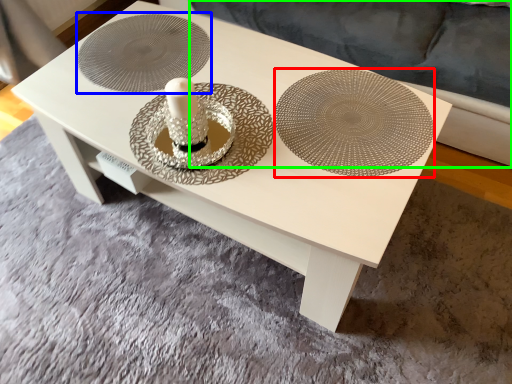
Question: Which object is the farthest from plate (highlighted by a red box)? Choose among these: circle (highlighted by a blue box) or couch (highlighted by a green box).

Choices:
 (A) circle
 (B) couch

Answer: (B)